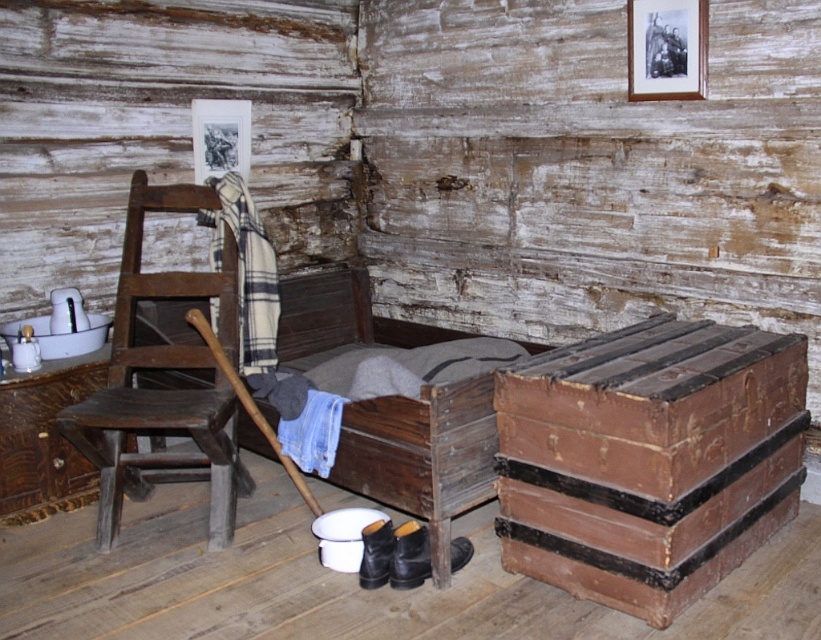
Question: Does brown leather trunk at lower right appear over black matte picture frame at upper left?

Choices:
 (A) no
 (B) yes

Answer: (A)

Question: Is wooden picture frame at upper right further to camera compared to black matte picture frame at upper left?

Choices:
 (A) yes
 (B) no

Answer: (B)

Question: Which point is closer to the camera?

Choices:
 (A) brown leather trunk at lower right
 (B) dark brown wood rocking chair at left

Answer: (A)

Question: Which object is the farthest from the dark brown wood rocking chair at left?

Choices:
 (A) brown leather trunk at lower right
 (B) black matte picture frame at upper left

Answer: (A)

Question: Does dark brown wood rocking chair at left have a larger size compared to black matte picture frame at upper left?

Choices:
 (A) no
 (B) yes

Answer: (B)

Question: Which object is closer to the camera taking this photo?

Choices:
 (A) black matte picture frame at upper left
 (B) dark brown wood rocking chair at left
 (C) wooden picture frame at upper right

Answer: (B)